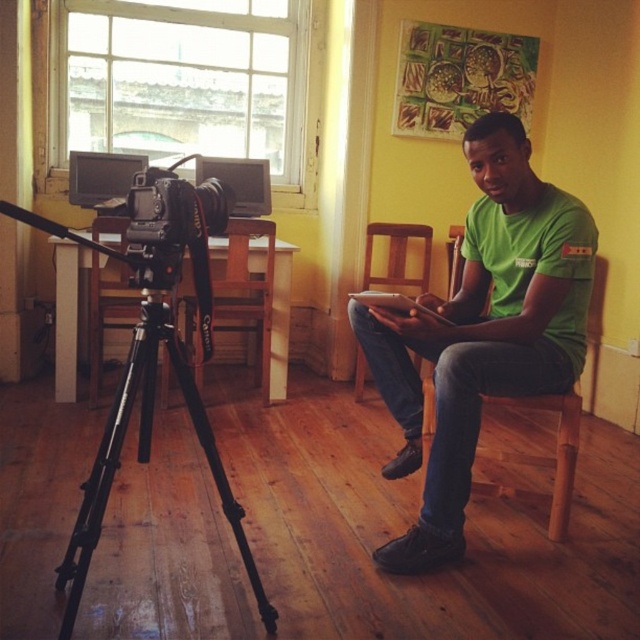
You are a photographer adjusting the camera position. You need to focus on the point closer to the viewer between the two points, point [163,376] and point [364,368]. Which point should you focus on?

You should focus on point [163,376] because it is closer to the viewer than point [364,368].